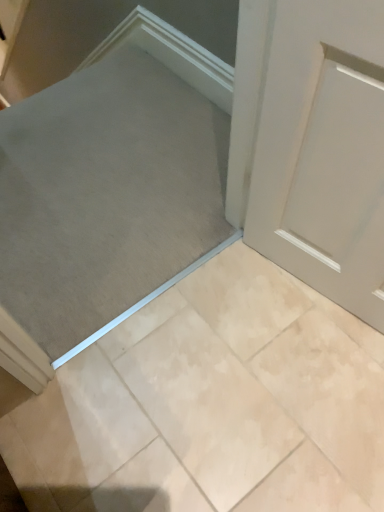
The width and height of the screenshot is (384, 512). What are the coordinates of `beige marble tile at center` in the screenshot? It's located at (212, 404).

The image size is (384, 512). Describe the element at coordinates (212, 404) in the screenshot. I see `beige marble tile at center` at that location.

Describe the element at coordinates (106, 195) in the screenshot. The height and width of the screenshot is (512, 384). I see `gray fabric at center` at that location.

The width and height of the screenshot is (384, 512). I want to click on gray fabric at center, so click(106, 195).

This screenshot has height=512, width=384. In order to click on beige marble tile at center in this screenshot , I will do `click(212, 404)`.

Between beige marble tile at center and gray fabric at center, which one appears on the right side from the viewer's perspective?

beige marble tile at center.

Does beige marble tile at center lie behind gray fabric at center?

That is False.

Which is closer to the camera, (366,387) or (187,223)?

Point (366,387) appears to be closer to the viewer than point (187,223).

From the image's perspective, is beige marble tile at center located above or below gray fabric at center?

From the image's perspective, beige marble tile at center appears below gray fabric at center.

From a real-world perspective, who is located higher, beige marble tile at center or gray fabric at center?

beige marble tile at center is physically above.

Which of these two, beige marble tile at center or gray fabric at center, is thinner?

Thinner between the two is beige marble tile at center.

Who is shorter, beige marble tile at center or gray fabric at center?

With less height is gray fabric at center.

Is beige marble tile at center smaller than gray fabric at center?

Correct, beige marble tile at center occupies less space than gray fabric at center.

Is beige marble tile at center completely or partially outside of gray fabric at center?

Yes, beige marble tile at center is not within gray fabric at center.

Is the surface of beige marble tile at center in direct contact with gray fabric at center?

No, beige marble tile at center is not touching gray fabric at center.

Is beige marble tile at center aimed at gray fabric at center?

Yes, beige marble tile at center is facing gray fabric at center.

What's the angular difference between beige marble tile at center and gray fabric at center's facing directions?

The facing directions of beige marble tile at center and gray fabric at center are 4.9e-06 degrees apart.

Identify the location of ceramic tile lying in front of the gray fabric at center. (212, 404).

Visually, is gray fabric at center positioned to the left or to the right of beige marble tile at center?

Clearly, gray fabric at center is on the left of beige marble tile at center in the image.

Which object is closer to the camera, gray fabric at center or beige marble tile at center?

Positioned in front is beige marble tile at center.

Considering the points (139, 256) and (90, 428), which point is in front, point (139, 256) or point (90, 428)?

Positioned in front is point (90, 428).

From the image's perspective, who appears lower, gray fabric at center or beige marble tile at center?

beige marble tile at center is shown below in the image.

From a real-world perspective, is gray fabric at center physically below beige marble tile at center?

Yes, from a real-world perspective, gray fabric at center is beneath beige marble tile at center.

Is gray fabric at center wider or thinner than beige marble tile at center?

In the image, gray fabric at center appears to be wider than beige marble tile at center.

Between gray fabric at center and beige marble tile at center, which one has less height?

gray fabric at center is shorter.

Which of these two, gray fabric at center or beige marble tile at center, is bigger?

gray fabric at center is bigger.

Is gray fabric at center surrounding beige marble tile at center?

Actually, beige marble tile at center is outside gray fabric at center.

Is gray fabric at center not near beige marble tile at center?

No, there isn't a large distance between gray fabric at center and beige marble tile at center.

Is gray fabric at center looking in the opposite direction of beige marble tile at center?

That's right, gray fabric at center is facing away from beige marble tile at center.

In the scene shown: How different are the orientations of gray fabric at center and beige marble tile at center in degrees?

4.9e-06 degrees separate the facing orientations of gray fabric at center and beige marble tile at center.

The height and width of the screenshot is (512, 384). In order to click on ceramic tile below the gray fabric at center (from the image's perspective) in this screenshot , I will do `click(212, 404)`.

I want to click on ramp behind the beige marble tile at center, so click(x=106, y=195).

Find the location of a particular element. Image resolution: width=384 pixels, height=512 pixels. ceramic tile in front of the gray fabric at center is located at coordinates coord(212,404).